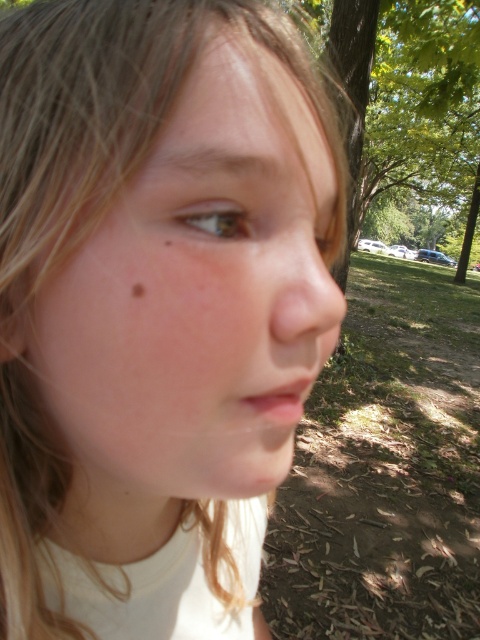
Looking at this image, between smooth skin face at center and brown matte freckle at lower left, which one appears on the right side from the viewer's perspective?

From the viewer's perspective, smooth skin face at center appears more on the right side.

Is smooth skin face at center shorter than brown matte freckle at lower left?

No, smooth skin face at center is not shorter than brown matte freckle at lower left.

Which is in front, point (300, 140) or point (139, 288)?

Point (139, 288) is in front.

Where is `smooth skin face at center`? Image resolution: width=480 pixels, height=640 pixels. smooth skin face at center is located at coordinates (197, 296).